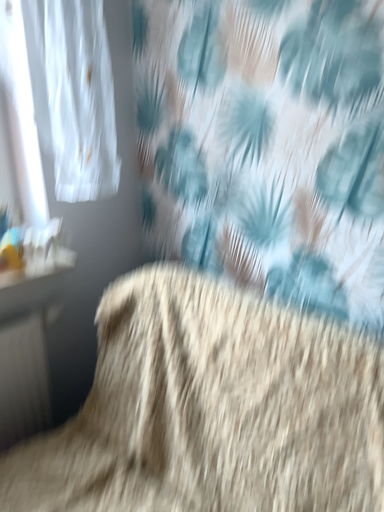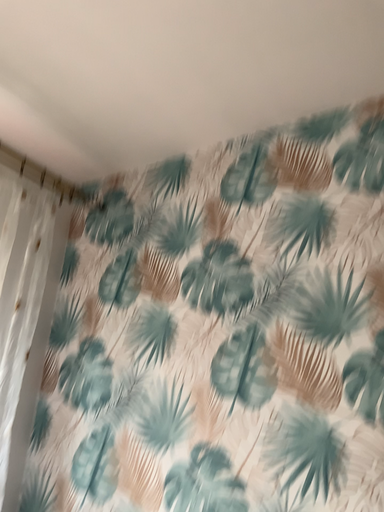
Question: How did the camera likely rotate when shooting the video?

Choices:
 (A) rotated upward
 (B) rotated downward

Answer: (A)